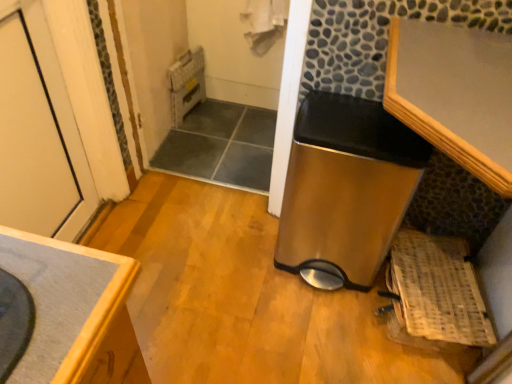
Question: Would you say metallic gray water heater at upper center, the first water heater in the left-to-right sequence, is inside or outside wooden countertop at lower left?

Choices:
 (A) outside
 (B) inside

Answer: (A)

Question: Based on their sizes in the image, would you say metallic gray water heater at upper center, which is counted as the 2th water heater, starting from the front, is bigger or smaller than wooden countertop at lower left?

Choices:
 (A) big
 (B) small

Answer: (B)

Question: Which object is positioned closest to the white painted wood door at left?

Choices:
 (A) wooden countertop at lower left
 (B) metallic gray water heater at upper center, which is counted as the 2th water heater, starting from the front
 (C) woven wood basket at lower right
 (D) stainless steel trash can at center, the 1th water heater positioned from the right

Answer: (B)

Question: Which of these objects is positioned closest to the stainless steel trash can at center, the 1th water heater positioned from the right?

Choices:
 (A) white painted wood door at left
 (B) woven wood basket at lower right
 (C) metallic gray water heater at upper center, the first water heater viewed from the back
 (D) wooden countertop at lower left

Answer: (B)